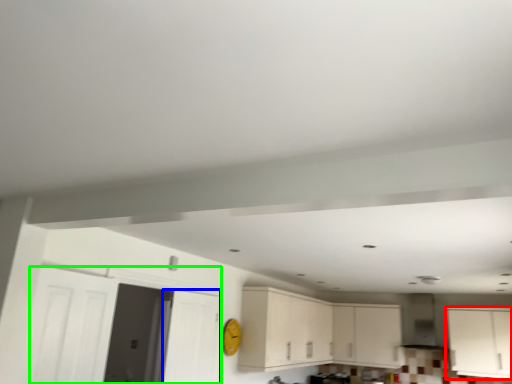
Question: Considering the real-world distances, which object is farthest from cabinetry (highlighted by a red box)? door (highlighted by a blue box) or door (highlighted by a green box)?

Choices:
 (A) door
 (B) door

Answer: (B)